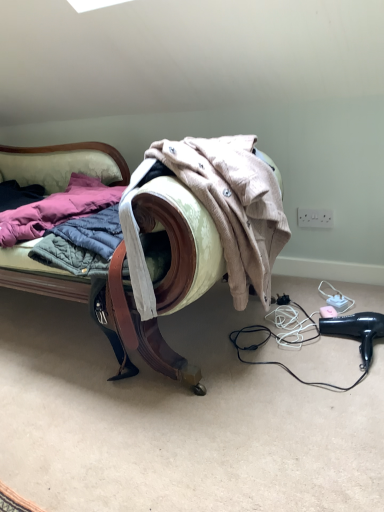
Identify the location of vacant point to the left of black plastic hair dryer at lower right. 301,354.